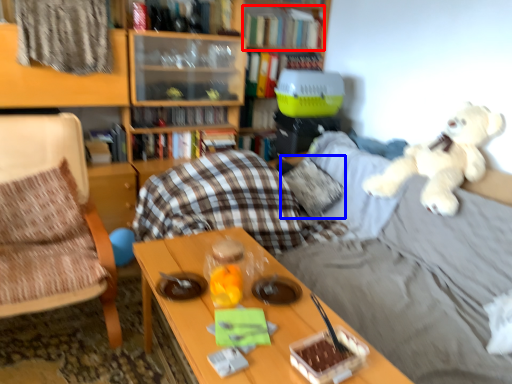
Question: Which object is closer to the camera taking this photo, book (highlighted by a red box) or pillow (highlighted by a blue box)?

Choices:
 (A) book
 (B) pillow

Answer: (B)